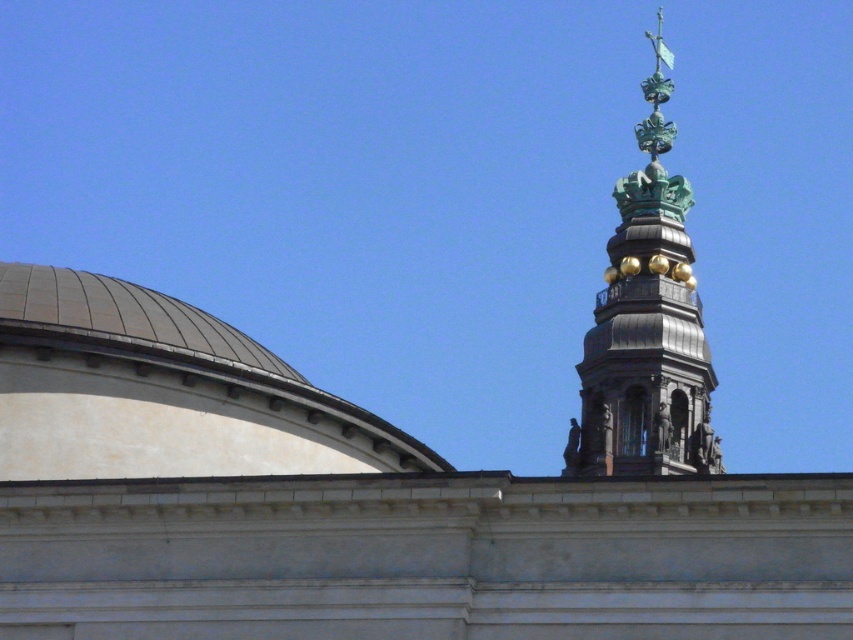
Question: Which point is farther to the camera?

Choices:
 (A) (666, 148)
 (B) (167, 419)

Answer: (A)

Question: In this image, where is smooth white dome at upper left located relative to green patina tower at upper right?

Choices:
 (A) above
 (B) below

Answer: (B)

Question: Which of the following is the closest to the observer?

Choices:
 (A) smooth white dome at upper left
 (B) green patina tower at upper right

Answer: (A)

Question: Can you confirm if smooth white dome at upper left is wider than green patina tower at upper right?

Choices:
 (A) yes
 (B) no

Answer: (A)

Question: Is smooth white dome at upper left smaller than green patina tower at upper right?

Choices:
 (A) yes
 (B) no

Answer: (A)